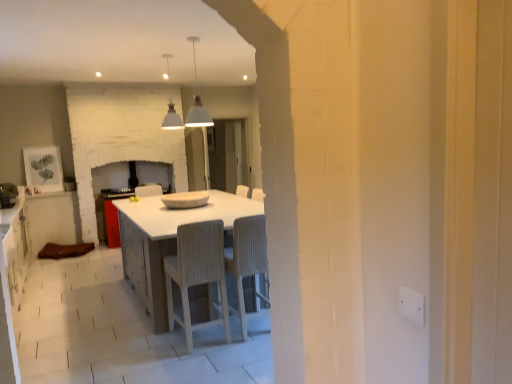
Question: Is white textured chair at center, the second chair from the left, bigger or smaller than white matte pendant light at upper center, the 1th light fixture when ordered from back to front?

Choices:
 (A) small
 (B) big

Answer: (B)

Question: Is white textured chair at center, marked as the first chair in a right-to-left arrangement, inside or outside of white matte pendant light at upper center, which is the 2th light fixture in right-to-left order?

Choices:
 (A) outside
 (B) inside

Answer: (A)

Question: Which object is positioned closest to the velvet beige armchair at center?

Choices:
 (A) white textured chair at center, the second chair from the left
 (B) white plastic electric outlet at right
 (C) matte brown cabinet at left
 (D) white matte pendant light at upper center, the 1th light fixture when ordered from back to front
 (E) brushed metal oven at left

Answer: (C)

Question: Which is farther from the white ribbed chair at center, placed as the second chair when sorted from right to left?

Choices:
 (A) velvet beige armchair at center
 (B) white glossy table at center
 (C) white matte pendant light at upper center, arranged as the second light fixture when viewed from the front
 (D) white textured chair at center, marked as the first chair in a right-to-left arrangement
 (E) brushed metal oven at left

Answer: (A)